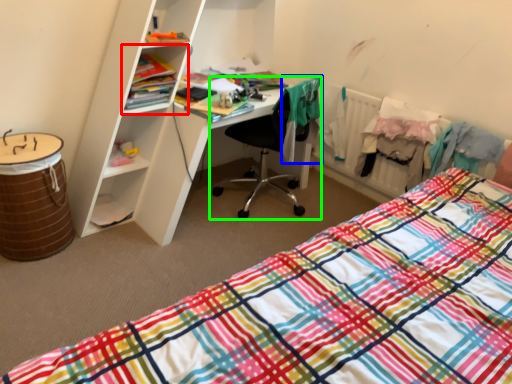
Question: Which is farther away from cabinet (highlighted by a red box)? clothing (highlighted by a blue box) or chair (highlighted by a green box)?

Choices:
 (A) clothing
 (B) chair

Answer: (A)